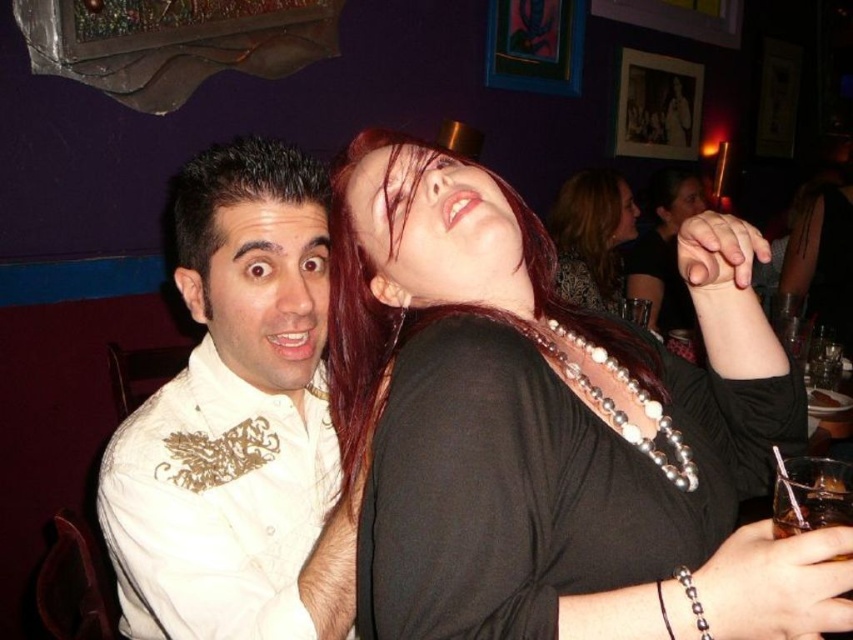
You are a photographer adjusting your camera settings to capture the details of the shiny black necklace at upper center and the pearl beaded necklace at upper center. Which necklace should you focus on first if you want to ensure both are in sharp focus, considering their positions?

The shiny black necklace at upper center is above the pearl beaded necklace at upper center, so focusing on the shiny black necklace at upper center first will help ensure both are in sharp focus as they are vertically aligned.

You are an interior designer assessing the layout of this bar. You need to place a decorative lamp between the two points labeled point (398, 560) and point (299, 340). Which point should the lamp be closer to in order to maintain a balanced aesthetic?

The lamp should be placed closer to point (299, 340) since point (398, 560) is closer to the viewer, creating a balanced composition by counteracting the depth difference between the two points.

You are a photographer trying to capture the black pearl necklace at upper right in the image. The camera you are using has a focus point at coordinate point (553, 428). Is this focus point correctly positioned to capture the black pearl necklace at upper right?

Yes, the focus point at coordinate point (553, 428) is correctly positioned to capture the black pearl necklace at upper right because the point marks the location of the black pearl necklace at upper right.